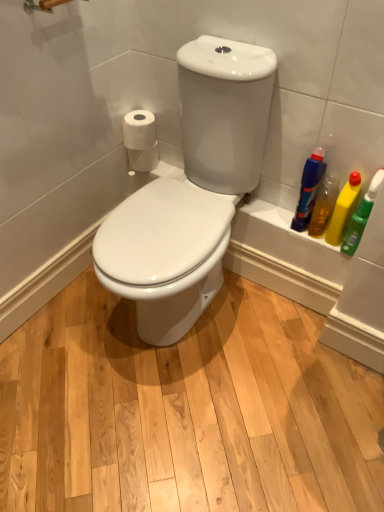
Question: Relative to yellow plastic bottle at right, the third cleaning product from the left, is white matte toilet paper at left, which appears as the 2th toilet paper when viewed from the front, in front or behind?

Choices:
 (A) behind
 (B) front

Answer: (A)

Question: Is point (145, 158) closer or farther from the camera than point (334, 220)?

Choices:
 (A) farther
 (B) closer

Answer: (A)

Question: Estimate the real-world distances between objects in this image. Which object is closer to the translucent plastic bottle at right, the 1th cleaning product positioned from the left?

Choices:
 (A) green plastic bottle at right, the 4th cleaning product from the left
 (B) white glossy toilet seat at center
 (C) yellow plastic bottle at right, the third cleaning product from the left
 (D) white matte toilet paper at left, acting as the 1th toilet paper starting from the back
 (E) yellow plastic bottle at right, the third cleaning product positioned from the right

Answer: (E)

Question: Which is farther from the green plastic bottle at right, the 1th cleaning product from the right?

Choices:
 (A) yellow plastic bottle at right, the 2th cleaning product when ordered from left to right
 (B) white glossy toilet seat at center
 (C) translucent plastic bottle at right, the 1th cleaning product positioned from the left
 (D) white matte toilet paper at upper left, placed as the 1th toilet paper when sorted from front to back
 (E) white matte toilet paper at left, acting as the 1th toilet paper starting from the back

Answer: (E)